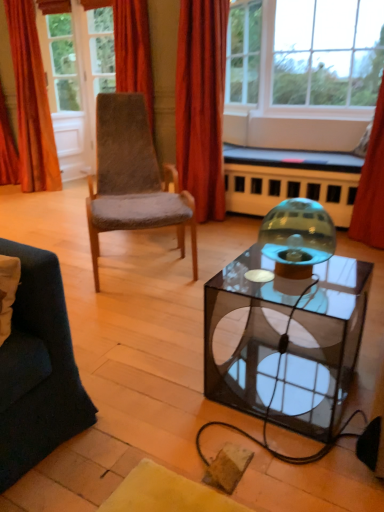
This screenshot has width=384, height=512. In order to click on free space in front of transparent glass candle holder at center in this screenshot , I will do `click(306, 293)`.